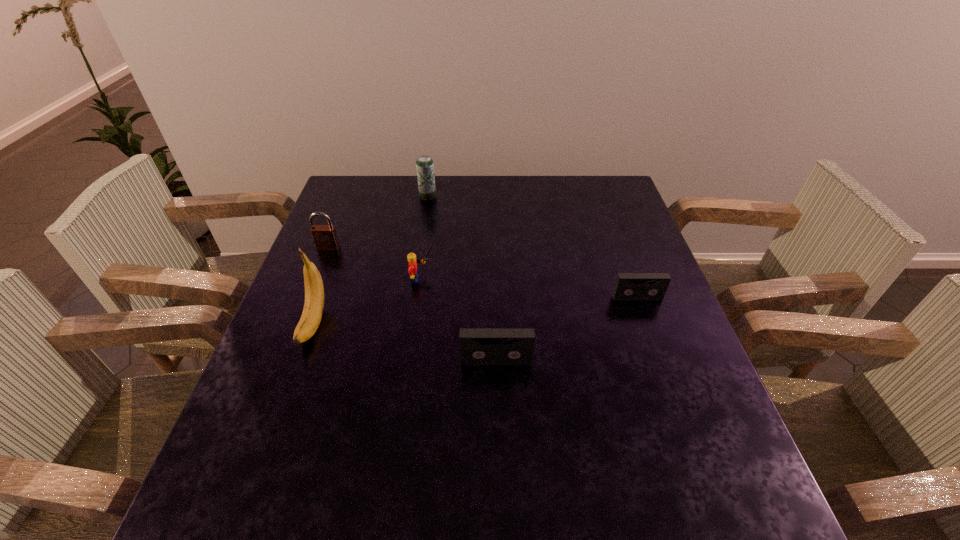
Where is `free space located 0.240m on the left of the farthest object`? free space located 0.240m on the left of the farthest object is located at coordinates (345, 196).

Find the location of a particular element. vacant space located at the start of the peel on the banana is located at coordinates (275, 433).

Locate an element on the screen. Image resolution: width=960 pixels, height=540 pixels. free space located on the front-facing side of the Lego is located at coordinates (563, 280).

You are a GUI agent. You are given a task and a screenshot of the screen. Output one action in this format:
    pyautogui.click(x=<x>, y=<y>)
    Task: Click on the free space located on the front-facing side of the second farthest object
    
    Given the screenshot: What is the action you would take?
    pyautogui.click(x=310, y=295)

The height and width of the screenshot is (540, 960). Find the location of `object located at the far edge`. object located at the far edge is located at coordinates (424, 164).

This screenshot has width=960, height=540. I want to click on banana at the left edge, so click(x=312, y=312).

Where is `padlock that is at the left edge`? The height and width of the screenshot is (540, 960). padlock that is at the left edge is located at coordinates pos(325,238).

Locate an element on the screen. Image resolution: width=960 pixels, height=540 pixels. object located at the right edge is located at coordinates (628, 286).

Find the location of a particular element. vacant area at the far edge is located at coordinates (541, 184).

The image size is (960, 540). I want to click on vacant space at the near edge of the desktop, so click(462, 456).